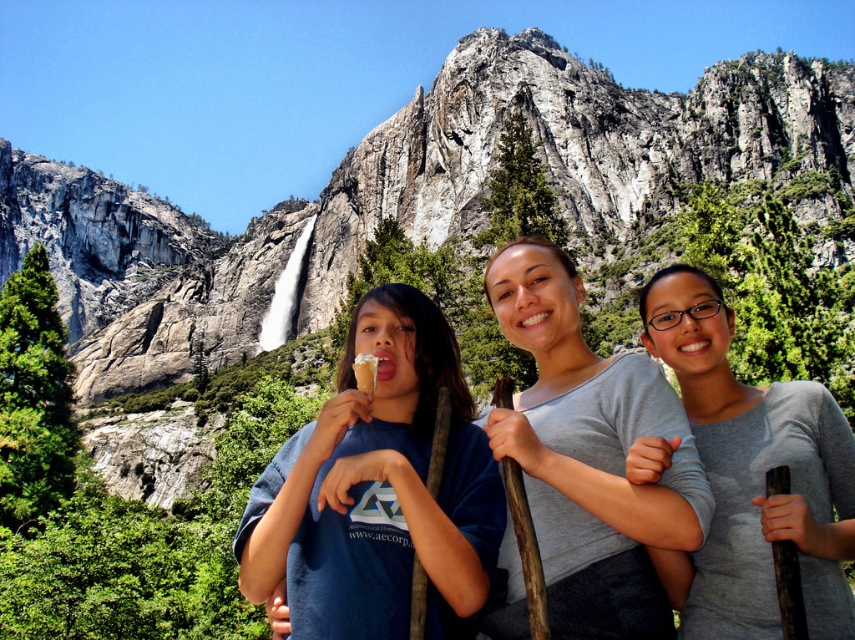
Question: Can you confirm if gray matte shirt at center is bigger than vanilla ice cream cone at center?

Choices:
 (A) no
 (B) yes

Answer: (B)

Question: Does gray cotton shirt at center appear under gray matte shirt at center?

Choices:
 (A) no
 (B) yes

Answer: (A)

Question: Which object is the closest to the gray cotton shirt at center?

Choices:
 (A) vanilla ice cream cone at center
 (B) gray matte shirt at center

Answer: (B)

Question: Among these points, which one is farthest from the camera?

Choices:
 (A) (578, 289)
 (B) (694, 323)

Answer: (A)

Question: Is the position of blue cotton shirt at center less distant than that of gray cotton shirt at center?

Choices:
 (A) no
 (B) yes

Answer: (A)

Question: Which object is positioned closest to the blue cotton shirt at center?

Choices:
 (A) gray cotton shirt at center
 (B) gray matte shirt at center
 (C) vanilla ice cream cone at center

Answer: (C)